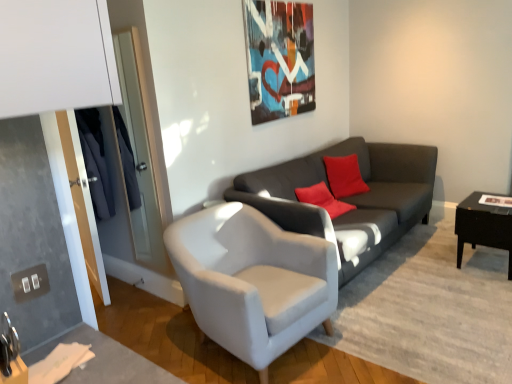
Question: From the image's perspective, is black glossy table at right beneath dark gray fabric couch at center?

Choices:
 (A) no
 (B) yes

Answer: (B)

Question: Can you confirm if black glossy table at right is bigger than dark gray fabric couch at center?

Choices:
 (A) yes
 (B) no

Answer: (B)

Question: Is black glossy table at right positioned beyond the bounds of dark gray fabric couch at center?

Choices:
 (A) no
 (B) yes

Answer: (B)

Question: Does black glossy table at right come in front of dark gray fabric couch at center?

Choices:
 (A) no
 (B) yes

Answer: (A)

Question: Does black glossy table at right appear on the right side of dark gray fabric couch at center?

Choices:
 (A) yes
 (B) no

Answer: (A)

Question: Does black glossy table at right have a greater width compared to dark gray fabric couch at center?

Choices:
 (A) no
 (B) yes

Answer: (A)

Question: Is dark gray fabric couch at center far from white fabric armchair at center?

Choices:
 (A) no
 (B) yes

Answer: (A)

Question: From the image's perspective, is dark gray fabric couch at center beneath white fabric armchair at center?

Choices:
 (A) no
 (B) yes

Answer: (A)

Question: Considering the relative sizes of dark gray fabric couch at center and white fabric armchair at center in the image provided, is dark gray fabric couch at center taller than white fabric armchair at center?

Choices:
 (A) yes
 (B) no

Answer: (A)

Question: From a real-world perspective, does dark gray fabric couch at center stand above white fabric armchair at center?

Choices:
 (A) yes
 (B) no

Answer: (A)

Question: Is dark gray fabric couch at center thinner than white fabric armchair at center?

Choices:
 (A) yes
 (B) no

Answer: (B)

Question: Is white fabric armchair at center located within dark gray fabric couch at center?

Choices:
 (A) yes
 (B) no

Answer: (B)

Question: Are dark gray fabric couch at center and black glossy table at right far apart?

Choices:
 (A) no
 (B) yes

Answer: (A)